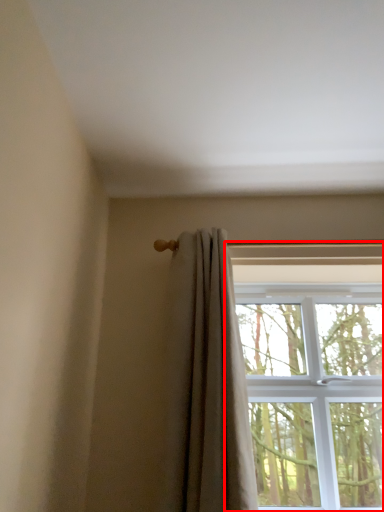
Question: Where is window (annotated by the red box) located in relation to curtain in the image?

Choices:
 (A) right
 (B) left

Answer: (A)